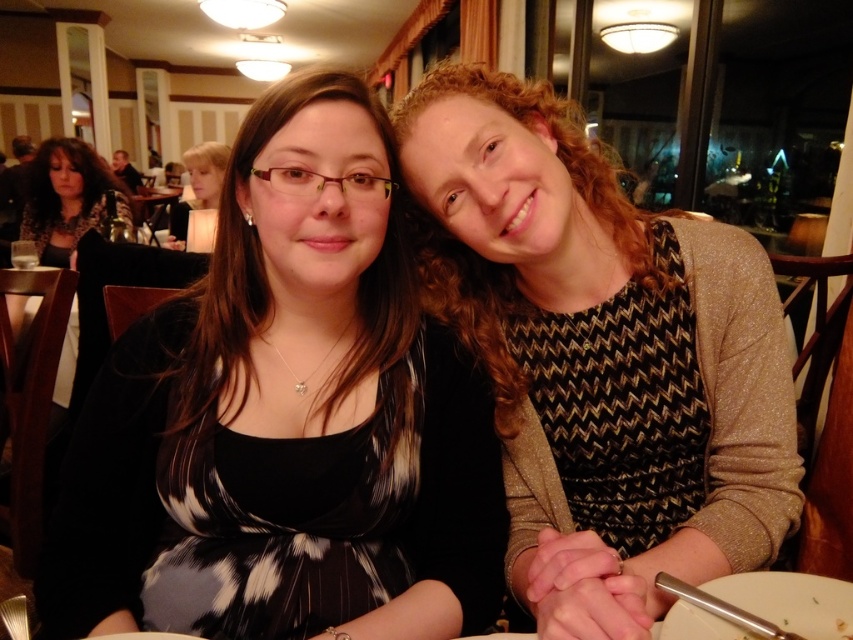
You are at a restaurant and want to place a small table between the two points labeled point [244,616] and point [608,330]. Which point should the table be closer to so that it is in front of the other point?

The table should be closer to point [608,330] because point [244,616] is in front of point [608,330], so placing the table near the back point would keep it in front.